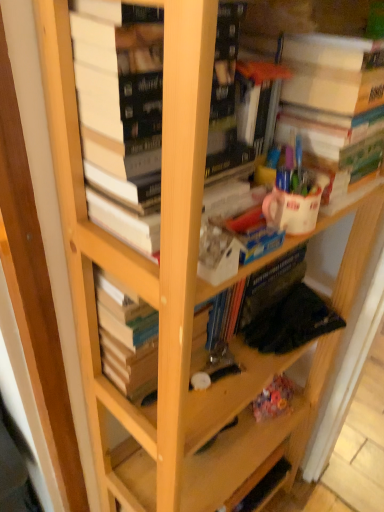
Measure the distance between point (x=122, y=318) and camera.

Point (x=122, y=318) and camera are 27.76 inches apart from each other.

Measure the distance between point (103, 219) and camera.

Point (103, 219) is 24.13 inches from camera.

Identify the location of white matte paper at upper right, marked as the third book in a left-to-right arrangement. (334, 105).

At what (x,y) coordinates should I click in order to perform the action: click on hardcover book at center, positioned as the 1th book in left-to-right order. Please return your answer as a coordinate pair (x, y). Looking at the image, I should click on (126, 338).

Does white matte paper at upper right, acting as the first book starting from the right, have a smaller size compared to white glossy coffee cup at upper center?

No, white matte paper at upper right, acting as the first book starting from the right, is not smaller than white glossy coffee cup at upper center.

Considering the sizes of objects white matte paper at upper right, marked as the third book in a left-to-right arrangement, and white glossy coffee cup at upper center in the image provided, who is wider, white matte paper at upper right, marked as the third book in a left-to-right arrangement, or white glossy coffee cup at upper center?

white matte paper at upper right, marked as the third book in a left-to-right arrangement.

Does point (375, 124) come in front of point (282, 194)?

No, it is not.

From the image's perspective, is white matte paper at upper right, acting as the first book starting from the right, above or below white glossy coffee cup at upper center?

white matte paper at upper right, acting as the first book starting from the right, is situated higher than white glossy coffee cup at upper center in the image.

In terms of height, does hardcover books at center, marked as the second book in a left-to-right arrangement, look taller or shorter compared to white matte paper at upper right, acting as the first book starting from the right?

In the image, hardcover books at center, marked as the second book in a left-to-right arrangement, appears to be taller than white matte paper at upper right, acting as the first book starting from the right.

In terms of width, does hardcover books at center, marked as the second book in a right-to-left arrangement, look wider or thinner when compared to white matte paper at upper right, marked as the third book in a left-to-right arrangement?

In the image, hardcover books at center, marked as the second book in a right-to-left arrangement, appears to be wider than white matte paper at upper right, marked as the third book in a left-to-right arrangement.

Who is bigger, hardcover books at center, marked as the second book in a right-to-left arrangement, or white matte paper at upper right, acting as the first book starting from the right?

Bigger between the two is hardcover books at center, marked as the second book in a right-to-left arrangement.

Looking at this image, from the image's perspective, is white glossy coffee cup at upper center over white matte paper at upper right, marked as the third book in a left-to-right arrangement?

No, from the image's perspective, white glossy coffee cup at upper center is not over white matte paper at upper right, marked as the third book in a left-to-right arrangement.

Locate an element on the screen. book on the right of white glossy coffee cup at upper center is located at coordinates (334, 105).

Is white glossy coffee cup at upper center positioned beyond the bounds of white matte paper at upper right, marked as the third book in a left-to-right arrangement?

Yes, white glossy coffee cup at upper center is not within white matte paper at upper right, marked as the third book in a left-to-right arrangement.

Which object is further away from the camera taking this photo, white matte paper at upper right, marked as the third book in a left-to-right arrangement, or hardcover books at center, marked as the second book in a right-to-left arrangement?

white matte paper at upper right, marked as the third book in a left-to-right arrangement, is behind.

The width and height of the screenshot is (384, 512). I want to click on book that is in front of the white matte paper at upper right, marked as the third book in a left-to-right arrangement, so click(121, 115).

Considering the sizes of objects white matte paper at upper right, marked as the third book in a left-to-right arrangement, and hardcover books at center, marked as the second book in a right-to-left arrangement, in the image provided, who is wider, white matte paper at upper right, marked as the third book in a left-to-right arrangement, or hardcover books at center, marked as the second book in a right-to-left arrangement,?

hardcover books at center, marked as the second book in a right-to-left arrangement, is wider.

From the image's perspective, is white matte paper at upper right, acting as the first book starting from the right, on hardcover books at center, marked as the second book in a left-to-right arrangement?

Yes, from the image's perspective, white matte paper at upper right, acting as the first book starting from the right, is over hardcover books at center, marked as the second book in a left-to-right arrangement.

In terms of width, does hardcover books at center, marked as the second book in a right-to-left arrangement, look wider or thinner when compared to white glossy coffee cup at upper center?

In the image, hardcover books at center, marked as the second book in a right-to-left arrangement, appears to be wider than white glossy coffee cup at upper center.

How distant is hardcover books at center, marked as the second book in a right-to-left arrangement, from white glossy coffee cup at upper center?

They are 20.66 centimeters apart.

Is hardcover books at center, marked as the second book in a right-to-left arrangement, bigger or smaller than white glossy coffee cup at upper center?

hardcover books at center, marked as the second book in a right-to-left arrangement, is bigger than white glossy coffee cup at upper center.

Can you confirm if hardcover books at center, marked as the second book in a left-to-right arrangement, is positioned to the right of white glossy coffee cup at upper center?

Incorrect, hardcover books at center, marked as the second book in a left-to-right arrangement, is not on the right side of white glossy coffee cup at upper center.

Which of these two, white glossy coffee cup at upper center or hardcover book at center, positioned as the 1th book in left-to-right order, stands taller?

hardcover book at center, positioned as the 1th book in left-to-right order.

From the image's perspective, is white glossy coffee cup at upper center on top of hardcover book at center, positioned as the 1th book in left-to-right order?

Yes, from the image's perspective, white glossy coffee cup at upper center is above hardcover book at center, positioned as the 1th book in left-to-right order.

Is white glossy coffee cup at upper center located outside hardcover book at center, positioned as the 1th book in left-to-right order?

white glossy coffee cup at upper center lies outside hardcover book at center, positioned as the 1th book in left-to-right order,'s area.

Considering the sizes of white glossy coffee cup at upper center and hardcover book at center, positioned as the 1th book in left-to-right order, in the image, is white glossy coffee cup at upper center wider or thinner than hardcover book at center, positioned as the 1th book in left-to-right order,?

Considering their sizes, white glossy coffee cup at upper center looks slimmer than hardcover book at center, positioned as the 1th book in left-to-right order.

From a real-world perspective, does hardcover book at center, positioned as the 1th book in left-to-right order, sit lower than white glossy coffee cup at upper center?

Yes.

Is hardcover book at center, which ranks as the 3th book in right-to-left order, facing towards white glossy coffee cup at upper center?

No.

Is hardcover book at center, which ranks as the 3th book in right-to-left order, not near white glossy coffee cup at upper center?

No, hardcover book at center, which ranks as the 3th book in right-to-left order, is not far from white glossy coffee cup at upper center.

Which of these two, hardcover book at center, positioned as the 1th book in left-to-right order, or white glossy coffee cup at upper center, is thinner?

white glossy coffee cup at upper center.

At what (x,y) coordinates should I click in order to perform the action: click on coffee cup located on the left of white matte paper at upper right, acting as the first book starting from the right. Please return your answer as a coordinate pair (x, y). This screenshot has width=384, height=512. Looking at the image, I should click on (291, 211).

The image size is (384, 512). What are the coordinates of `book on the right of the hardcover books at center, marked as the second book in a left-to-right arrangement` in the screenshot? It's located at (334, 105).

Considering their positions, is white glossy coffee cup at upper center positioned further to hardcover books at center, marked as the second book in a right-to-left arrangement, than white matte paper at upper right, acting as the first book starting from the right?

white glossy coffee cup at upper center is further to hardcover books at center, marked as the second book in a right-to-left arrangement.

From the image, which object appears to be farther from white matte paper at upper right, acting as the first book starting from the right, hardcover book at center, which ranks as the 3th book in right-to-left order, or hardcover books at center, marked as the second book in a left-to-right arrangement?

hardcover book at center, which ranks as the 3th book in right-to-left order, is positioned further to the anchor white matte paper at upper right, acting as the first book starting from the right.

From the picture: Looking at the image, which one is located further to hardcover books at center, marked as the second book in a left-to-right arrangement, white matte paper at upper right, marked as the third book in a left-to-right arrangement, or white glossy coffee cup at upper center?

The object further to hardcover books at center, marked as the second book in a left-to-right arrangement, is white glossy coffee cup at upper center.

Which object lies nearer to the anchor point hardcover book at center, positioned as the 1th book in left-to-right order, hardcover books at center, marked as the second book in a right-to-left arrangement, or white glossy coffee cup at upper center?

hardcover books at center, marked as the second book in a right-to-left arrangement.

Considering their positions, is white matte paper at upper right, marked as the third book in a left-to-right arrangement, positioned closer to hardcover book at center, which ranks as the 3th book in right-to-left order, than white glossy coffee cup at upper center?

The object closer to hardcover book at center, which ranks as the 3th book in right-to-left order, is white glossy coffee cup at upper center.

From the image, which object appears to be farther from hardcover books at center, marked as the second book in a left-to-right arrangement, hardcover book at center, which ranks as the 3th book in right-to-left order, or white matte paper at upper right, acting as the first book starting from the right?

hardcover book at center, which ranks as the 3th book in right-to-left order, is positioned further to the anchor hardcover books at center, marked as the second book in a left-to-right arrangement.

Based on their spatial positions, is white glossy coffee cup at upper center or hardcover books at center, marked as the second book in a left-to-right arrangement, closer to white matte paper at upper right, marked as the third book in a left-to-right arrangement?

The object closer to white matte paper at upper right, marked as the third book in a left-to-right arrangement, is white glossy coffee cup at upper center.

When comparing their distances from hardcover books at center, marked as the second book in a right-to-left arrangement, does white matte paper at upper right, marked as the third book in a left-to-right arrangement, or hardcover book at center, which ranks as the 3th book in right-to-left order, seem further?

hardcover book at center, which ranks as the 3th book in right-to-left order.

Locate an element on the screen. book between white matte paper at upper right, marked as the third book in a left-to-right arrangement, and hardcover book at center, which ranks as the 3th book in right-to-left order, vertically is located at coordinates (121, 115).

Where is `coffee cup between white matte paper at upper right, acting as the first book starting from the right, and hardcover book at center, positioned as the 1th book in left-to-right order, from top to bottom`? Image resolution: width=384 pixels, height=512 pixels. coffee cup between white matte paper at upper right, acting as the first book starting from the right, and hardcover book at center, positioned as the 1th book in left-to-right order, from top to bottom is located at coordinates (291, 211).